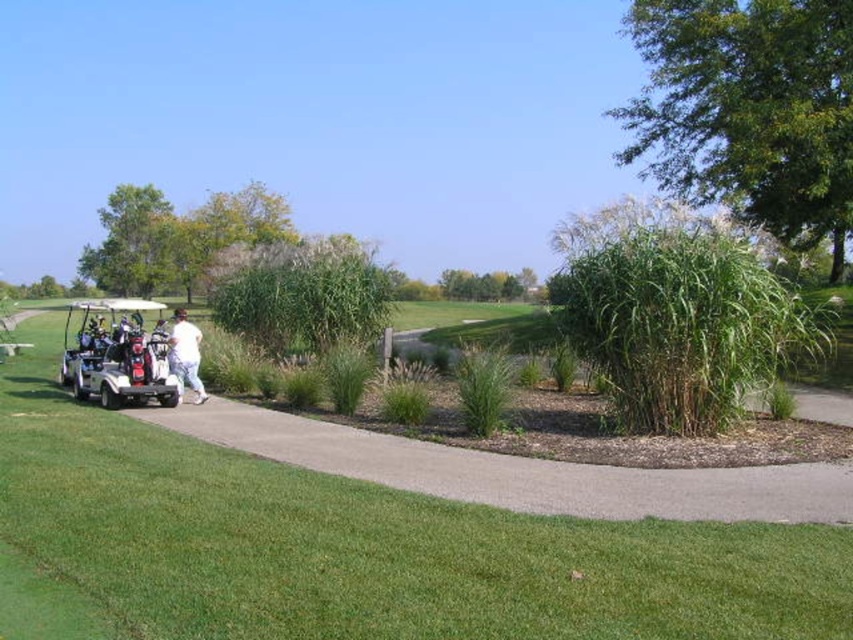
Question: Which object is positioned closest to the gray concrete path at center?

Choices:
 (A) white cotton pants at center
 (B) green grass at center

Answer: (B)

Question: Which point is farther from the camera taking this photo?

Choices:
 (A) (97, 355)
 (B) (175, 323)

Answer: (A)

Question: Can you confirm if gray concrete path at center is positioned below white plastic golf cart at left?

Choices:
 (A) no
 (B) yes

Answer: (B)

Question: Does gray concrete path at center have a larger size compared to white cotton pants at center?

Choices:
 (A) yes
 (B) no

Answer: (B)

Question: Can you confirm if green grass at center is bigger than gray concrete path at center?

Choices:
 (A) yes
 (B) no

Answer: (A)

Question: Considering the real-world distances, which object is closest to the white plastic golf cart at left?

Choices:
 (A) white cotton pants at center
 (B) gray concrete path at center
 (C) green grass at center

Answer: (A)